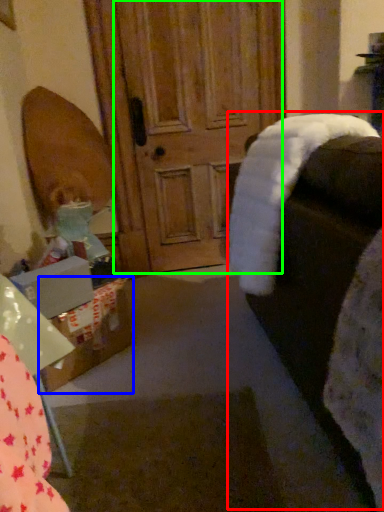
Question: Which object is positioned farthest from rocking chair (highlighted by a red box)? Select from cardboard box (highlighted by a blue box) and screen door (highlighted by a green box).

Choices:
 (A) cardboard box
 (B) screen door

Answer: (B)